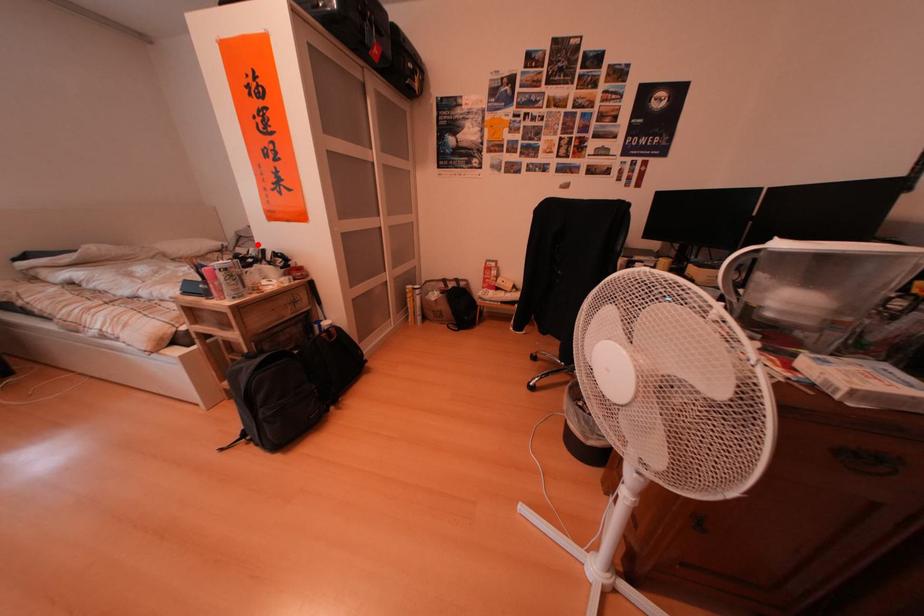
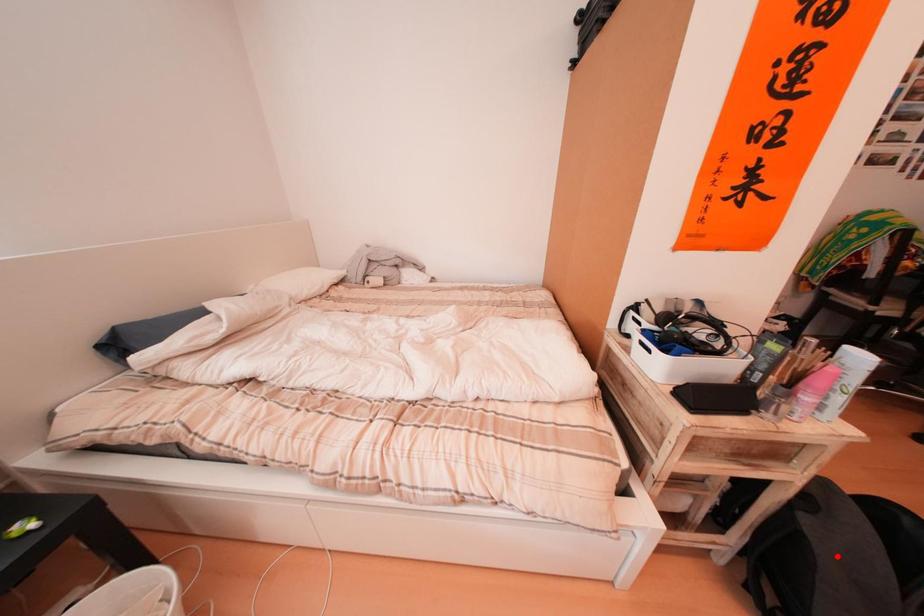
I am providing you with two images of the same scene from different viewpoints. A red point is marked on the first image and another point is marked on the second image. Is the red point in image1 aligned with the point shown in image2?

No